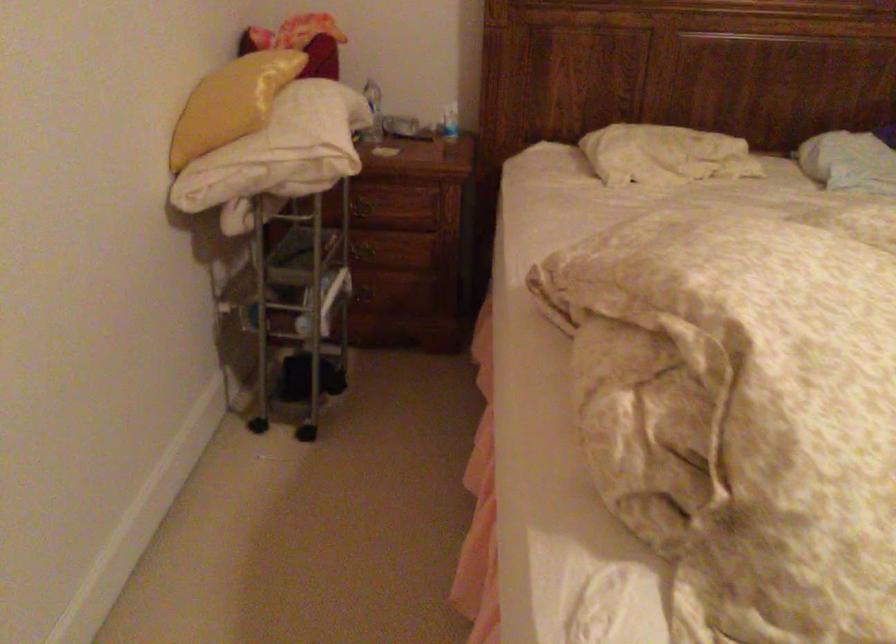
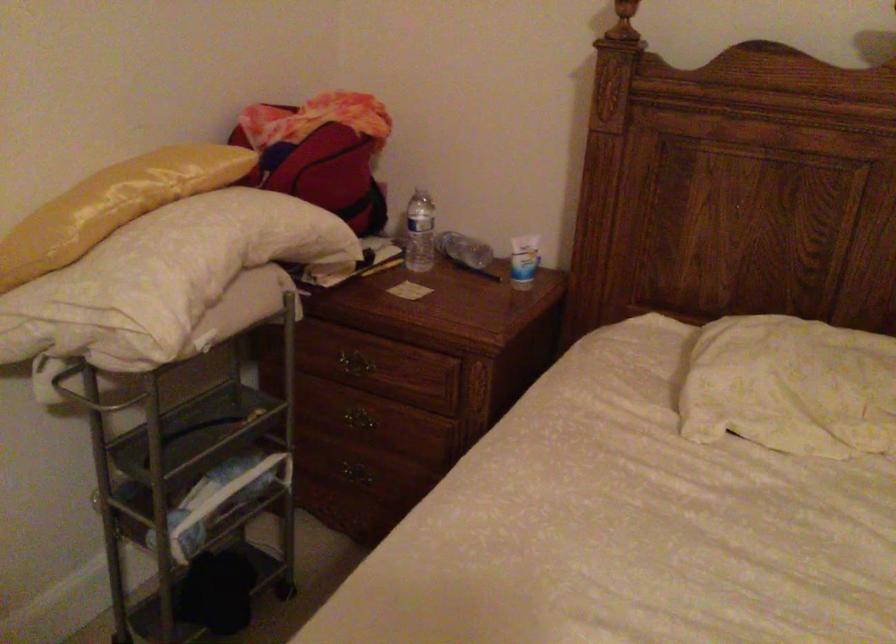
Find the pixel in the second image that matches pixel 365 259 in the first image.

(357, 426)